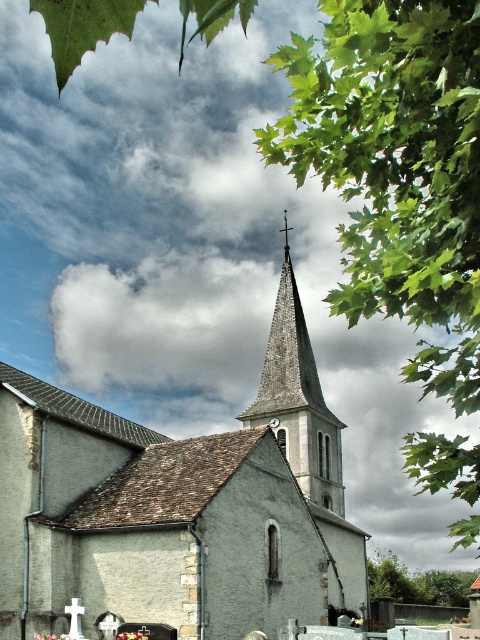
Is point (271, 580) positioned behind point (269, 371)?

No, it is not.

Between gray stone church steeple at center and gray stone spire at center, which one is positioned lower?

gray stone church steeple at center

Between point (171, 484) and point (284, 426), which one is positioned in front?

Point (171, 484) is in front.

Identify the location of gray stone church steeple at center. This screenshot has width=480, height=640. (179, 508).